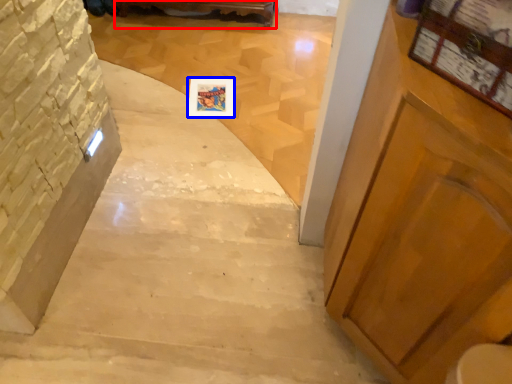
Question: Which of the following is the closest to the observer, furniture (highlighted by a red box) or picture frame (highlighted by a blue box)?

Choices:
 (A) furniture
 (B) picture frame

Answer: (B)